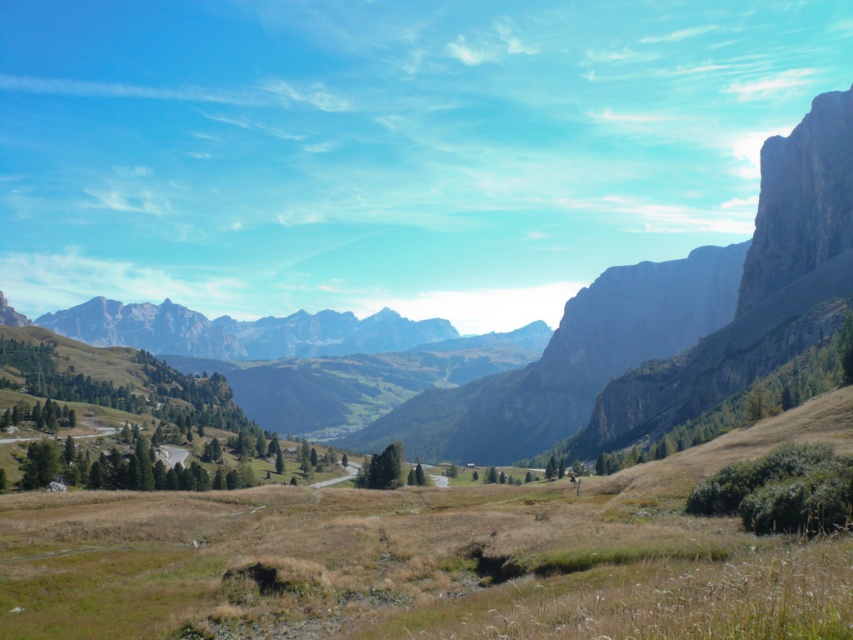
You are standing at the point marked as point (456, 544) in the image. You want to walk to the valley below. Is the valley in front of you or behind you?

The valley is in front of you because you are at point (456, 544), which is 206.79 feet away from the viewer. Since the valley is in the middle ground, it is located in front of your current position.

You are a hiker standing at the edge of the grassy meadow and looking towards the center of the image. You see the dry grass at center and the rocky gray mountain range at center. Which one appears taller from your vantage point?

The dry grass at center has a lesser height compared to the rocky gray mountain range at center, so the rocky gray mountain range at center appears taller from your vantage point.